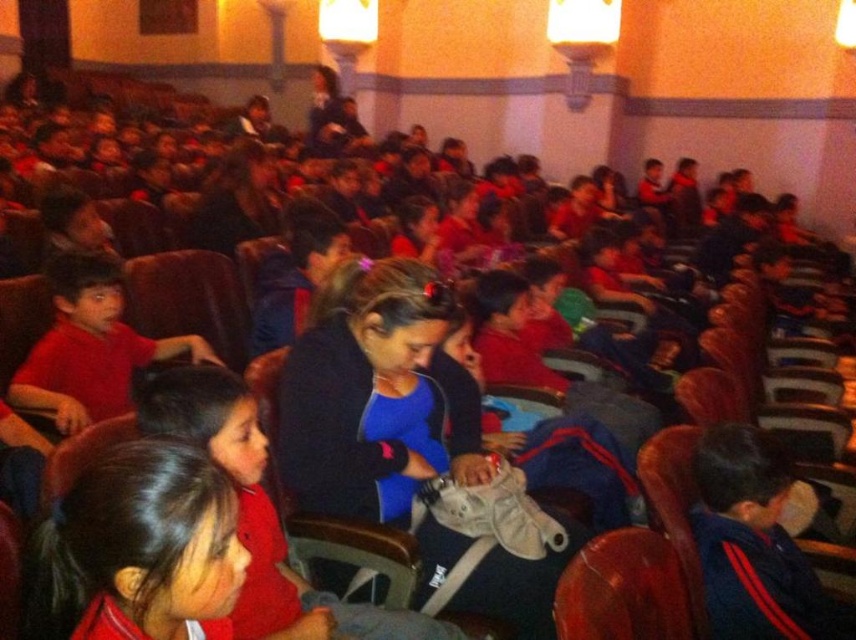
Who is positioned more to the left, matte red shirt at center or blue fleece jacket at lower right?

Positioned to the left is matte red shirt at center.

The width and height of the screenshot is (856, 640). I want to click on matte red shirt at center, so point(135,545).

Can you confirm if matte red shirt at center is wider than matte red shirt at left?

No.

Measure the distance between point (201, 467) and camera.

Point (201, 467) and camera are 3.44 feet apart from each other.

You are a GUI agent. You are given a task and a screenshot of the screen. Output one action in this format:
    pyautogui.click(x=<x>, y=<y>)
    Task: Click on the matte red shirt at center
    Image resolution: width=856 pixels, height=640 pixels.
    Given the screenshot: What is the action you would take?
    pyautogui.click(x=135, y=545)

You are a GUI agent. You are given a task and a screenshot of the screen. Output one action in this format:
    pyautogui.click(x=<x>, y=<y>)
    Task: Click on the blue fleece jacket at lower right
    This screenshot has height=640, width=856.
    Given the screenshot: What is the action you would take?
    pyautogui.click(x=753, y=545)

Locate an element on the screen. This screenshot has height=640, width=856. blue fleece jacket at lower right is located at coordinates (753, 545).

What are the coordinates of `blue fleece jacket at lower right` in the screenshot? It's located at (753, 545).